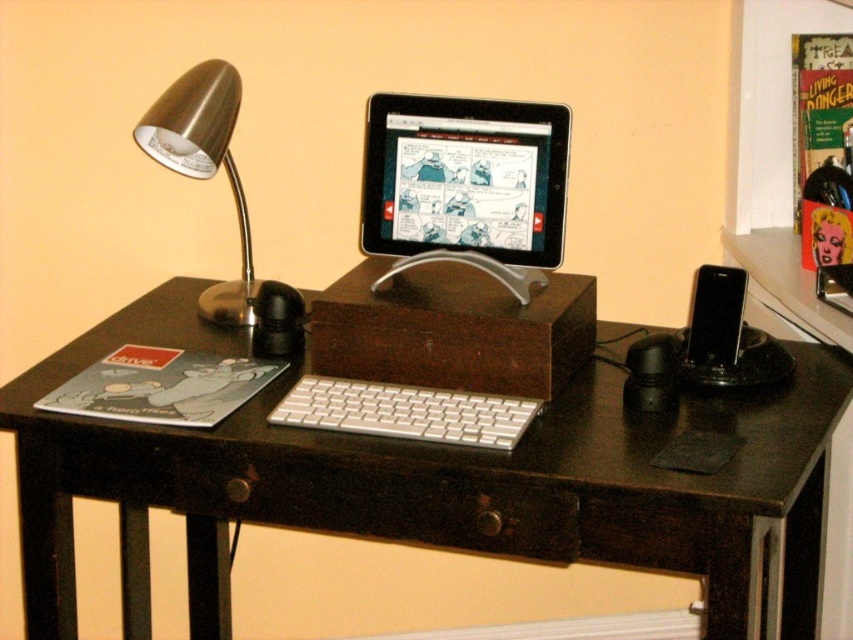
Which is below, black wood drawer at center or brushed metal desk lamp at left?

black wood drawer at center

Can you confirm if black wood drawer at center is taller than brushed metal desk lamp at left?

No.

The image size is (853, 640). What do you see at coordinates (415, 509) in the screenshot? I see `black wood drawer at center` at bounding box center [415, 509].

At what (x,y) coordinates should I click in order to perform the action: click on black wood drawer at center. Please return your answer as a coordinate pair (x, y). Looking at the image, I should click on (415, 509).

Does silver metallic tablet at center have a lesser height compared to white aluminum keyboard at center?

In fact, silver metallic tablet at center may be taller than white aluminum keyboard at center.

Is silver metallic tablet at center taller than white aluminum keyboard at center?

Yes, silver metallic tablet at center is taller than white aluminum keyboard at center.

The image size is (853, 640). I want to click on silver metallic tablet at center, so click(465, 184).

At what (x,y) coordinates should I click in order to perform the action: click on silver metallic tablet at center. Please return your answer as a coordinate pair (x, y). Image resolution: width=853 pixels, height=640 pixels. Looking at the image, I should click on (465, 184).

Does brushed metal desk lamp at left come behind white aluminum keyboard at center?

Yes.

Is the position of brushed metal desk lamp at left less distant than that of white aluminum keyboard at center?

No.

You are a GUI agent. You are given a task and a screenshot of the screen. Output one action in this format:
    pyautogui.click(x=<x>, y=<y>)
    Task: Click on the brushed metal desk lamp at left
    The image size is (853, 640).
    Given the screenshot: What is the action you would take?
    pyautogui.click(x=207, y=172)

Locate an element on the screen. This screenshot has height=640, width=853. brushed metal desk lamp at left is located at coordinates (207, 172).